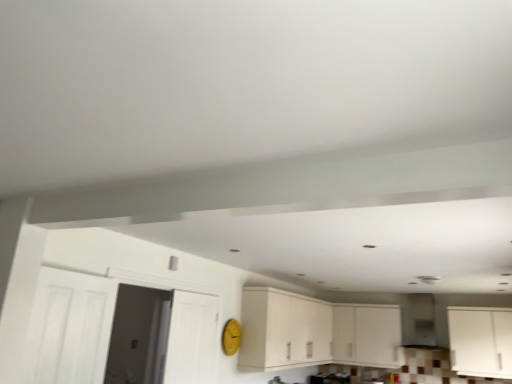
Question: Can you confirm if white matte cabinet at center, positioned as the second cabinetry in left-to-right order, is positioned to the right of white wooden door at left, which is counted as the second door, starting from the back?

Choices:
 (A) no
 (B) yes

Answer: (B)

Question: Considering the relative sizes of white matte cabinet at center, acting as the second cabinetry starting from the right, and white wooden door at left, the second door viewed from the front, in the image provided, is white matte cabinet at center, acting as the second cabinetry starting from the right, thinner than white wooden door at left, the second door viewed from the front,?

Choices:
 (A) yes
 (B) no

Answer: (B)

Question: Are white matte cabinet at center, positioned as the second cabinetry in left-to-right order, and white wooden door at left, the second door viewed from the front, located far from each other?

Choices:
 (A) no
 (B) yes

Answer: (B)

Question: Would you say white wooden door at left, the second door viewed from the front, is part of white matte cabinet at center, positioned as the second cabinetry in left-to-right order,'s contents?

Choices:
 (A) yes
 (B) no

Answer: (B)

Question: Is white matte cabinet at center, positioned as the second cabinetry in left-to-right order, facing towards white wooden door at left, which is counted as the second door, starting from the back?

Choices:
 (A) yes
 (B) no

Answer: (A)

Question: Considering the relative positions of matte white cabinets at center, acting as the 1th cabinetry starting from the left, and white matte door at left, which is the first door from back to front, in the image provided, is matte white cabinets at center, acting as the 1th cabinetry starting from the left, to the left or to the right of white matte door at left, which is the first door from back to front,?

Choices:
 (A) left
 (B) right

Answer: (B)

Question: From the image's perspective, is matte white cabinets at center, acting as the third cabinetry starting from the right, positioned above or below white matte door at left, placed as the 3th door when sorted from front to back?

Choices:
 (A) above
 (B) below

Answer: (B)

Question: From a real-world perspective, is matte white cabinets at center, acting as the 1th cabinetry starting from the left, physically located above or below white matte door at left, placed as the 3th door when sorted from front to back?

Choices:
 (A) below
 (B) above

Answer: (B)

Question: Would you say matte white cabinets at center, acting as the 1th cabinetry starting from the left, is inside or outside white matte door at left, which is the first door from back to front?

Choices:
 (A) outside
 (B) inside

Answer: (A)

Question: Based on their positions, is white matte door at left, the 3th door from the back, located to the left or right of white matte door at left, which is the first door from back to front?

Choices:
 (A) right
 (B) left

Answer: (B)

Question: Considering the positions of point (53, 271) and point (198, 372), is point (53, 271) closer or farther from the camera than point (198, 372)?

Choices:
 (A) farther
 (B) closer

Answer: (B)

Question: Relative to white matte door at left, which is the first door from back to front, is white matte door at left, the 3th door from the back, in front or behind?

Choices:
 (A) front
 (B) behind

Answer: (A)

Question: In terms of height, does white matte door at left, the 3th door from the back, look taller or shorter compared to white matte door at left, placed as the 3th door when sorted from front to back?

Choices:
 (A) short
 (B) tall

Answer: (A)

Question: Considering their positions, is white matte cabinet at right, acting as the third cabinetry starting from the left, located in front of or behind white wooden door at left, which is counted as the second door, starting from the back?

Choices:
 (A) front
 (B) behind

Answer: (B)

Question: Considering the positions of white matte cabinet at right, the 1th cabinetry positioned from the right, and white wooden door at left, which is counted as the second door, starting from the back, in the image, is white matte cabinet at right, the 1th cabinetry positioned from the right, taller or shorter than white wooden door at left, which is counted as the second door, starting from the back,?

Choices:
 (A) tall
 (B) short

Answer: (B)